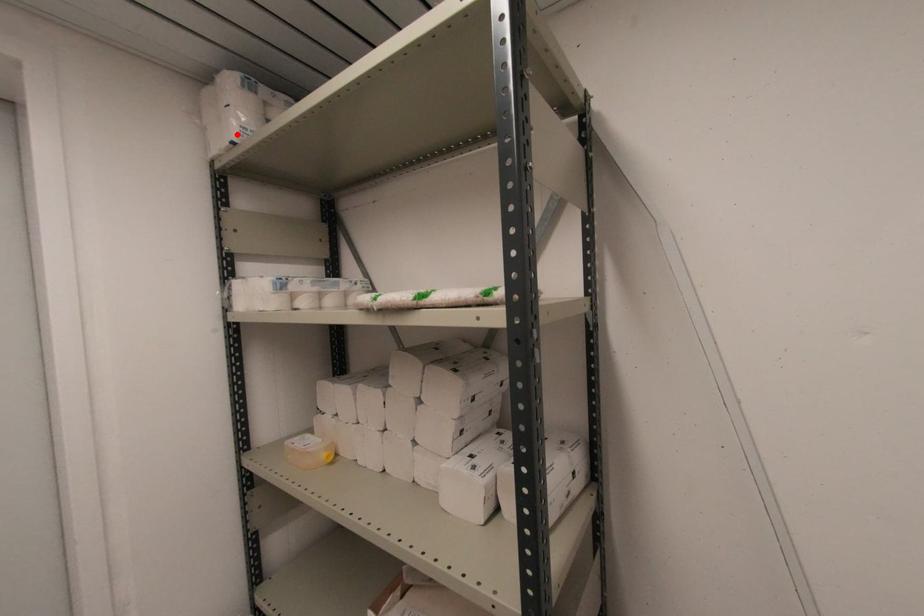
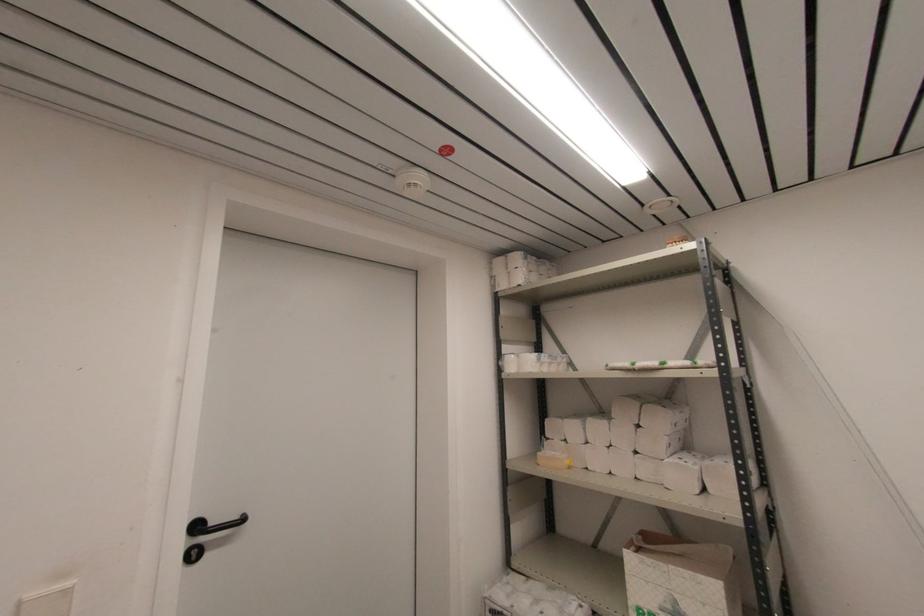
Locate, in the second image, the point that corresponds to the highlighted location in the first image.

(524, 282)